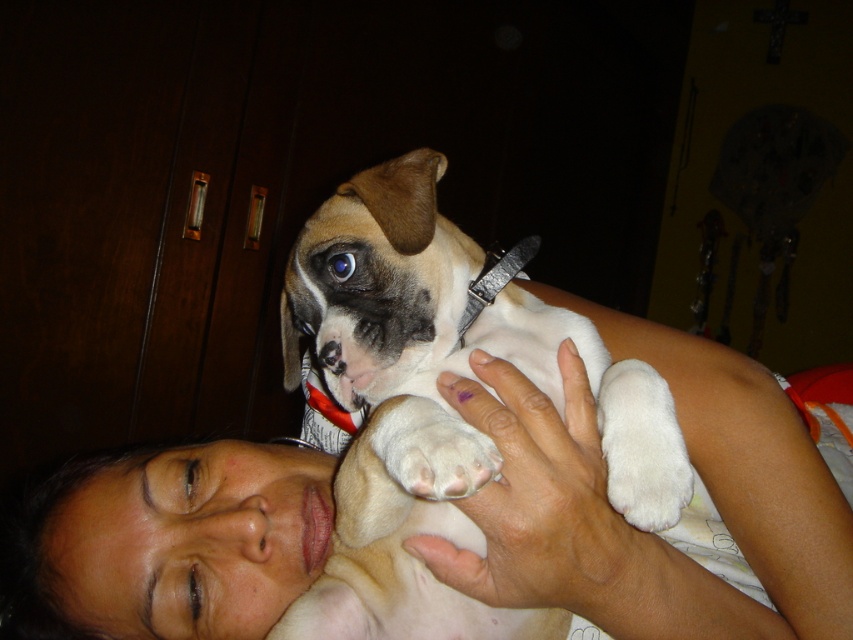
You are a veterinarian examining a dog and its paw. You see the white matte dog at center and the white soft paw at center in the image. Which object is positioned to the right?

The white soft paw at center is positioned to the right of the white matte dog at center.

You are a veterinarian examining the image of a dog and its paw. Based on the scene, can you determine if the white matte dog at center is closer to you than the white soft paw at center?

The white matte dog at center is in front of the white soft paw at center, so yes, the dog is closer to you than the paw.

You are looking at the image and see two points marked as point 1 and point 2. The first point is at coordinate (654, 378) and the second is at (376, 412). Which point is closer to you?

Point 1 at coordinate (654, 378) is closer to you because it is further to the viewer than point 2 at (376, 412).